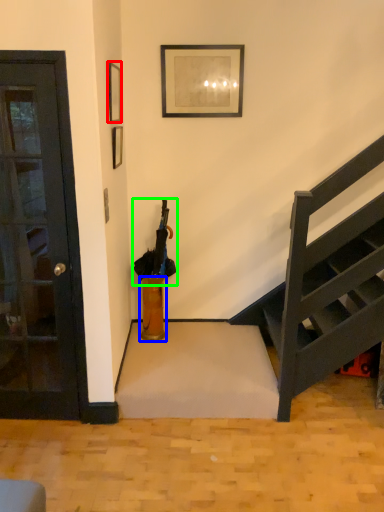
Question: Estimate the real-world distances between objects in this image. Which object is farther from picture frame (highlighted by a red box), vase (highlighted by a blue box) or umbrella (highlighted by a green box)?

Choices:
 (A) vase
 (B) umbrella

Answer: (A)